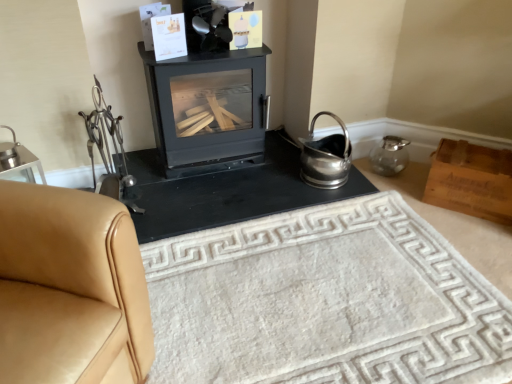
Find the location of a particular element. The image size is (512, 384). free space above black matte fireplace at center (from a real-world perspective) is located at coordinates (232, 178).